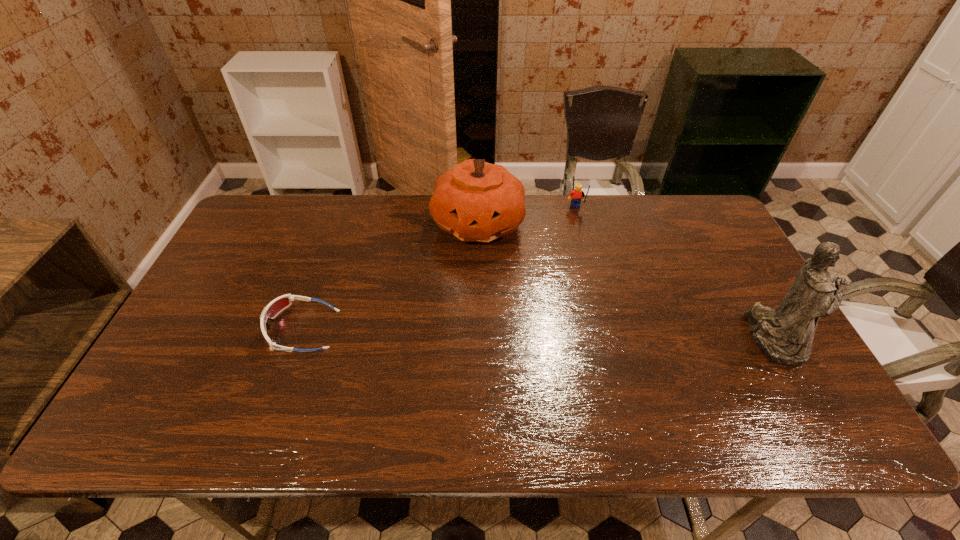
Locate an element on the screen. Image resolution: width=960 pixels, height=540 pixels. object situated at the right edge is located at coordinates (785, 335).

The height and width of the screenshot is (540, 960). Find the location of `object that is at the near right corner`. object that is at the near right corner is located at coordinates (785, 335).

The image size is (960, 540). In order to click on vacant space at the far edge of the desktop in this screenshot , I will do `click(607, 227)`.

You are a GUI agent. You are given a task and a screenshot of the screen. Output one action in this format:
    pyautogui.click(x=<x>, y=<y>)
    Task: Click on the blank area at the near edge
    Image resolution: width=960 pixels, height=540 pixels.
    Given the screenshot: What is the action you would take?
    pyautogui.click(x=513, y=389)

In the image, there is a desktop. At what (x,y) coordinates should I click in order to perform the action: click on vacant space at the left edge. Please return your answer as a coordinate pair (x, y). Looking at the image, I should click on (274, 246).

In the image, there is a desktop. At what (x,y) coordinates should I click in order to perform the action: click on vacant space at the right edge. Please return your answer as a coordinate pair (x, y). The image size is (960, 540). Looking at the image, I should click on (737, 325).

Where is `vacant region at the far right corner`? The height and width of the screenshot is (540, 960). vacant region at the far right corner is located at coordinates (705, 221).

The height and width of the screenshot is (540, 960). Find the location of `vacant area that lies between the tallest object and the second tallest object`. vacant area that lies between the tallest object and the second tallest object is located at coordinates (626, 281).

The image size is (960, 540). I want to click on vacant point located between the second shortest object and the third object from right to left, so click(527, 217).

Where is `free space that is in between the third object from right to left and the figurine`? free space that is in between the third object from right to left and the figurine is located at coordinates (626, 281).